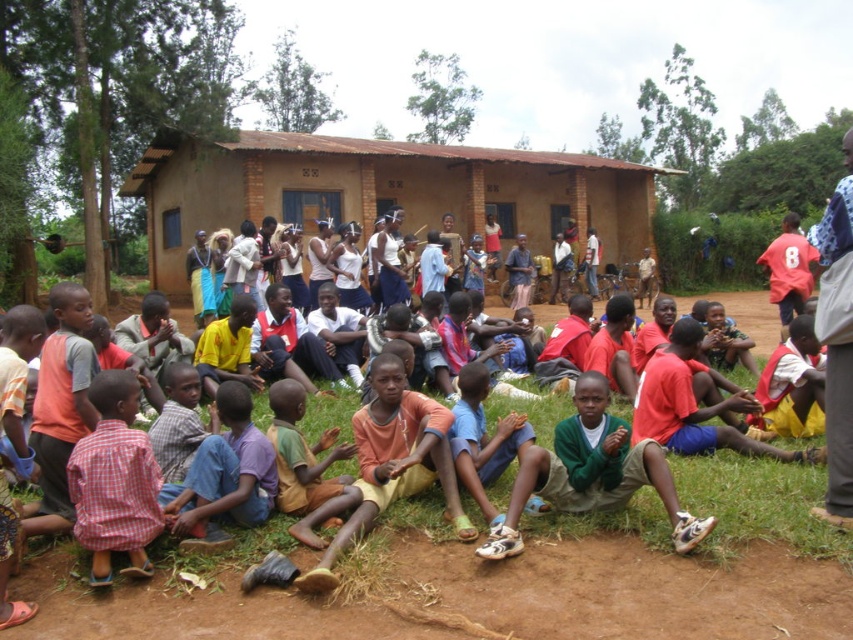
You are a photographer trying to capture a closeup of the yellow cotton shirt at center without including the light blue fabric pants at lower center in the frame. Is this possible based on their positions?

The yellow cotton shirt at center is located below the light blue fabric pants at lower center, so it is possible to capture a closeup of the yellow cotton shirt at center without including the light blue fabric pants at lower center by framing the shot to exclude the lower area where the pants are positioned.